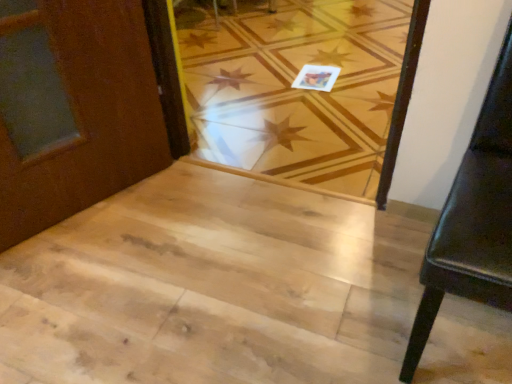
Find the location of a particular element. This screenshot has width=512, height=384. natural wood stairwell at center is located at coordinates (212, 288).

Find the location of a particular element. natural wood floor at center is located at coordinates [295, 89].

The height and width of the screenshot is (384, 512). Identify the location of natural wood stairwell at center. (212, 288).

Is natural wood floor at center far away from natural wood stairwell at center?

No, there isn't a large distance between natural wood floor at center and natural wood stairwell at center.

In the scene shown: From a real-world perspective, relative to natural wood stairwell at center, is natural wood floor at center vertically above or below?

Clearly, from a real-world perspective, natural wood floor at center is below natural wood stairwell at center.

Which is behind, point (357, 75) or point (158, 339)?

The point (357, 75) is more distant.

Which is more to the right, natural wood floor at center or natural wood stairwell at center?

From the viewer's perspective, natural wood floor at center appears more on the right side.

Where is `plank below the black leather chair at right (from a real-world perspective)`? This screenshot has height=384, width=512. plank below the black leather chair at right (from a real-world perspective) is located at coordinates (295, 89).

Between point (356, 91) and point (453, 265), which one is positioned in front?

The point (453, 265) is closer.

Are natural wood floor at center and black leather chair at right far apart?

Yes, natural wood floor at center and black leather chair at right are quite far apart.

Considering the positions of point (298, 338) and point (499, 285), is point (298, 338) closer or farther from the camera than point (499, 285)?

Clearly, point (298, 338) is more distant from the camera than point (499, 285).

How many degrees apart are the facing directions of natural wood stairwell at center and black leather chair at right?

natural wood stairwell at center and black leather chair at right are facing 176 degrees away from each other.

From the image's perspective, is natural wood stairwell at center on top of black leather chair at right?

No, from the image's perspective, natural wood stairwell at center is not over black leather chair at right.

In the image, is natural wood stairwell at center positioned in front of or behind black leather chair at right?

In the image, natural wood stairwell at center appears behind black leather chair at right.

Are black leather chair at right and natural wood stairwell at center beside each other?

No.

Image resolution: width=512 pixels, height=384 pixels. What are the coordinates of `stairwell behind the black leather chair at right` in the screenshot? It's located at (212, 288).

How distant is black leather chair at right from natural wood stairwell at center?

They are 22.85 inches apart.

Is point (453, 226) closer or farther from the camera than point (248, 225)?

Point (453, 226).

Based on the photo, is natural wood stairwell at center positioned far away from natural wood floor at center?

No, natural wood stairwell at center is not far from natural wood floor at center.

Which object is closer to the camera taking this photo, natural wood stairwell at center or natural wood floor at center?

natural wood stairwell at center is more forward.

Considering the sizes of natural wood stairwell at center and natural wood floor at center in the image, is natural wood stairwell at center taller or shorter than natural wood floor at center?

natural wood stairwell at center is shorter than natural wood floor at center.

Is natural wood stairwell at center surrounding natural wood floor at center?

No, natural wood stairwell at center does not contain natural wood floor at center.

Does point (417, 322) lie behind point (352, 87)?

That is False.

Between black leather chair at right and natural wood floor at center, which one has larger size?

natural wood floor at center is bigger.

From the image's perspective, which one is positioned higher, black leather chair at right or natural wood floor at center?

natural wood floor at center appears higher in the image.

Considering the relative positions of black leather chair at right and natural wood floor at center in the image provided, is black leather chair at right to the right of natural wood floor at center from the viewer's perspective?

Yes.

Identify the location of stairwell on the left side of natural wood floor at center. Image resolution: width=512 pixels, height=384 pixels. (212, 288).

The image size is (512, 384). I want to click on plank above the black leather chair at right (from the image's perspective), so click(295, 89).

Considering their positions, is black leather chair at right positioned closer to natural wood floor at center than natural wood stairwell at center?

natural wood stairwell at center.

Based on their spatial positions, is black leather chair at right or natural wood floor at center further from natural wood stairwell at center?

The object further to natural wood stairwell at center is natural wood floor at center.

Looking at the image, which one is located closer to natural wood stairwell at center, natural wood floor at center or black leather chair at right?

Among the two, black leather chair at right is located nearer to natural wood stairwell at center.

Considering their positions, is natural wood floor at center positioned closer to black leather chair at right than natural wood stairwell at center?

The object closer to black leather chair at right is natural wood stairwell at center.

From the image, which object appears to be nearer to natural wood floor at center, natural wood stairwell at center or black leather chair at right?

natural wood stairwell at center lies closer to natural wood floor at center than the other object.

Considering their positions, is natural wood stairwell at center positioned further to black leather chair at right than natural wood floor at center?

natural wood floor at center is positioned further to the anchor black leather chair at right.

The width and height of the screenshot is (512, 384). In order to click on furniture between natural wood floor at center and natural wood stairwell at center vertically in this screenshot , I will do point(473,220).